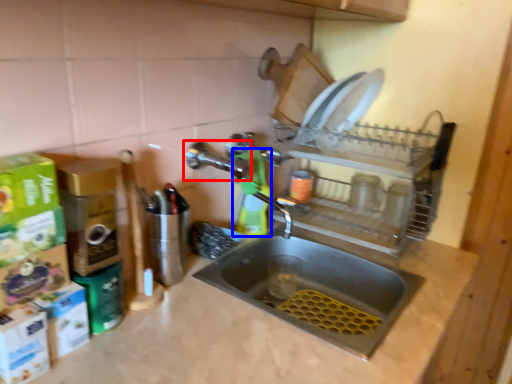
Question: Among these objects, which one is nearest to the camera, tap (highlighted by a red box) or cleaning product (highlighted by a blue box)?

Choices:
 (A) tap
 (B) cleaning product

Answer: (A)